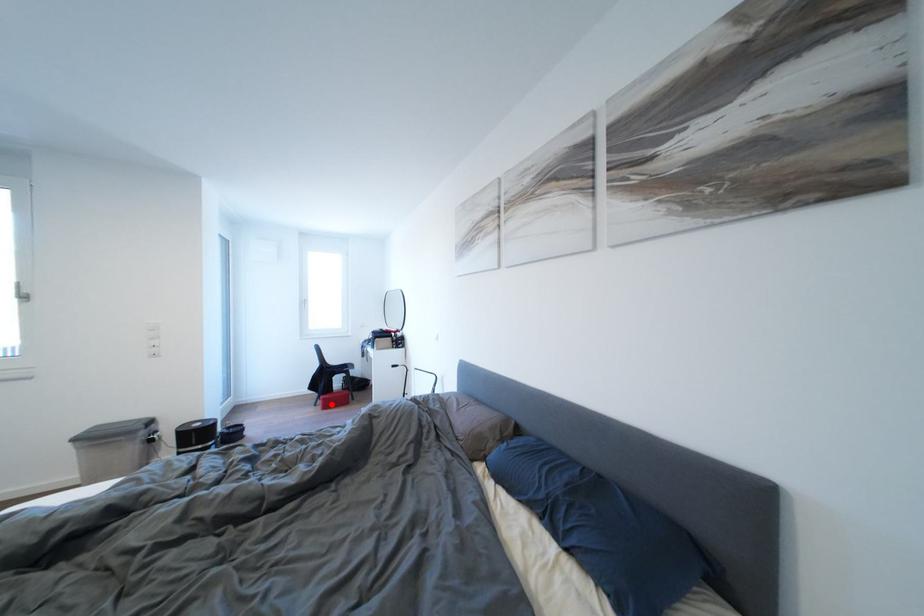
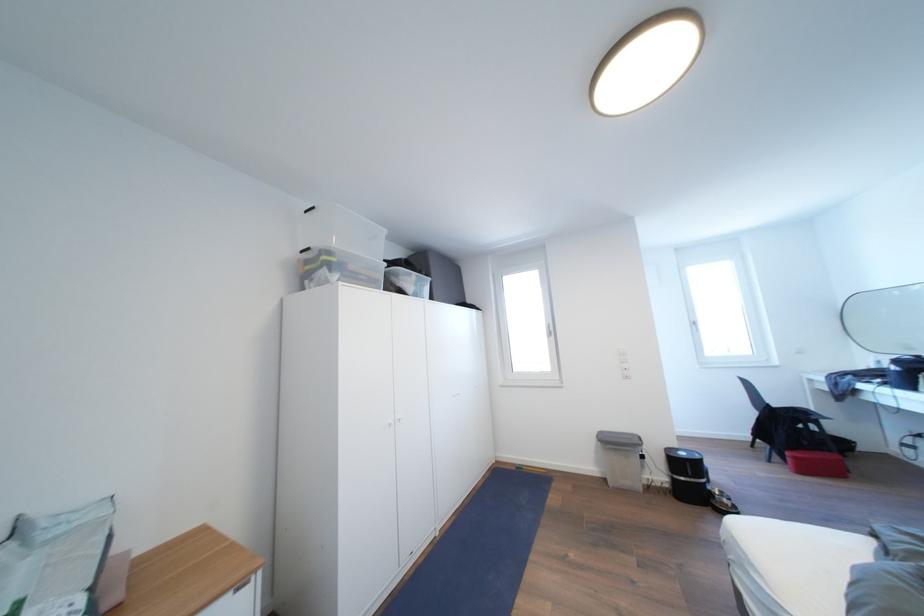
The point at the highlighted location is marked in the first image. Where is the corresponding point in the second image?

(803, 463)